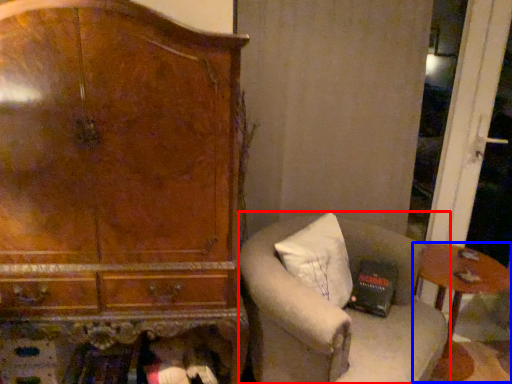
Question: Among these objects, which one is nearest to the camera, chair (highlighted by a red box) or table (highlighted by a blue box)?

Choices:
 (A) chair
 (B) table

Answer: (A)